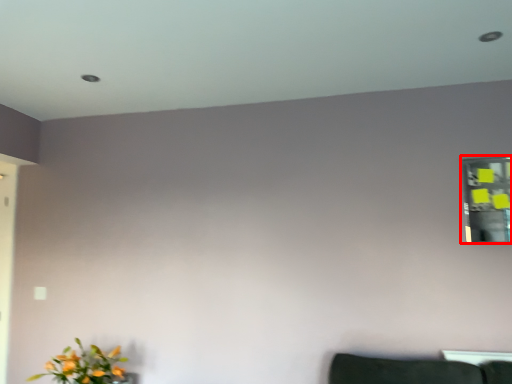
Question: Observing the image, what is the correct spatial positioning of mirror (annotated by the red box) in reference to flower?

Choices:
 (A) right
 (B) left

Answer: (A)